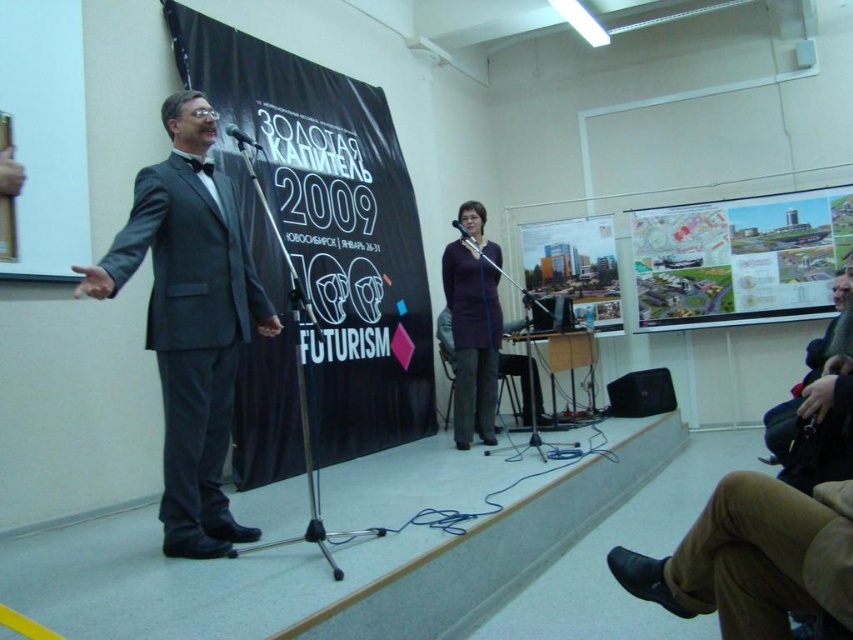
Question: Which object is farther from the camera taking this photo?

Choices:
 (A) matte gray suit at left
 (B) metallic silver microphone at center
 (C) matte paper map at upper right

Answer: (C)

Question: Among these points, which one is nearest to the camera?

Choices:
 (A) (229, 131)
 (B) (96, 264)
 (C) (473, 243)
 (D) (747, 291)

Answer: (A)

Question: Considering the relative positions of purple fabric dress at center and metallic silver microphone at center in the image provided, where is purple fabric dress at center located with respect to metallic silver microphone at center?

Choices:
 (A) right
 (B) left

Answer: (A)

Question: Is matte gray suit at left thinner than matte paper map at upper right?

Choices:
 (A) no
 (B) yes

Answer: (B)

Question: Which object is farther from the camera taking this photo?

Choices:
 (A) metallic silver microphone at center
 (B) matte glass building at center
 (C) matte black microphone at center
 (D) matte gray suit at left

Answer: (B)

Question: Is matte paper map at upper right to the right of matte black microphone at center from the viewer's perspective?

Choices:
 (A) no
 (B) yes

Answer: (B)